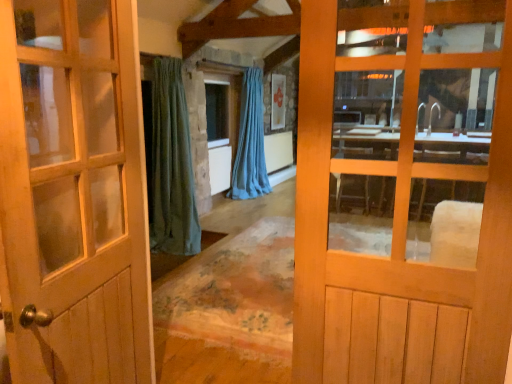
Question: In which direction should I rotate to look at light brown wooden door at center, acting as the 1th door starting from the right?

Choices:
 (A) right
 (B) left

Answer: (A)

Question: Is light brown wooden door at center, acting as the 1th door starting from the right, wider than matte wooden door at center, positioned as the 2th door in right-to-left order?

Choices:
 (A) no
 (B) yes

Answer: (A)

Question: Is light brown wooden door at center, acting as the 1th door starting from the right, positioned before matte wooden door at center, the first door in the left-to-right sequence?

Choices:
 (A) yes
 (B) no

Answer: (B)

Question: Considering the relative sizes of light brown wooden door at center, acting as the 1th door starting from the right, and matte wooden door at center, the first door in the left-to-right sequence, in the image provided, is light brown wooden door at center, acting as the 1th door starting from the right, smaller than matte wooden door at center, the first door in the left-to-right sequence,?

Choices:
 (A) no
 (B) yes

Answer: (B)

Question: Are light brown wooden door at center, which is counted as the 2th door, starting from the left, and matte wooden door at center, the first door in the left-to-right sequence, far apart?

Choices:
 (A) yes
 (B) no

Answer: (B)

Question: Considering the relative sizes of light brown wooden door at center, acting as the 1th door starting from the right, and matte wooden door at center, positioned as the 2th door in right-to-left order, in the image provided, is light brown wooden door at center, acting as the 1th door starting from the right, bigger than matte wooden door at center, positioned as the 2th door in right-to-left order,?

Choices:
 (A) yes
 (B) no

Answer: (B)

Question: Considering the relative sizes of light brown wooden door at center, which is counted as the 2th door, starting from the left, and matte wooden door at center, positioned as the 2th door in right-to-left order, in the image provided, is light brown wooden door at center, which is counted as the 2th door, starting from the left, taller than matte wooden door at center, positioned as the 2th door in right-to-left order,?

Choices:
 (A) yes
 (B) no

Answer: (B)

Question: Is light brown wooden door at center, which is counted as the 2th door, starting from the left, thinner than clear glass window at center?

Choices:
 (A) yes
 (B) no

Answer: (B)

Question: From the image's perspective, is light brown wooden door at center, acting as the 1th door starting from the right, below clear glass window at center?

Choices:
 (A) yes
 (B) no

Answer: (A)

Question: Does light brown wooden door at center, which is counted as the 2th door, starting from the left, contain clear glass window at center?

Choices:
 (A) yes
 (B) no

Answer: (B)

Question: Can you confirm if light brown wooden door at center, which is counted as the 2th door, starting from the left, is positioned to the right of clear glass window at center?

Choices:
 (A) no
 (B) yes

Answer: (B)

Question: From a real-world perspective, is light brown wooden door at center, which is counted as the 2th door, starting from the left, beneath clear glass window at center?

Choices:
 (A) yes
 (B) no

Answer: (A)

Question: Does light brown wooden door at center, acting as the 1th door starting from the right, have a smaller size compared to clear glass window at center?

Choices:
 (A) yes
 (B) no

Answer: (B)

Question: From the image's perspective, does blue fabric curtain at center appear higher than light brown wooden door at center, acting as the 1th door starting from the right?

Choices:
 (A) no
 (B) yes

Answer: (B)